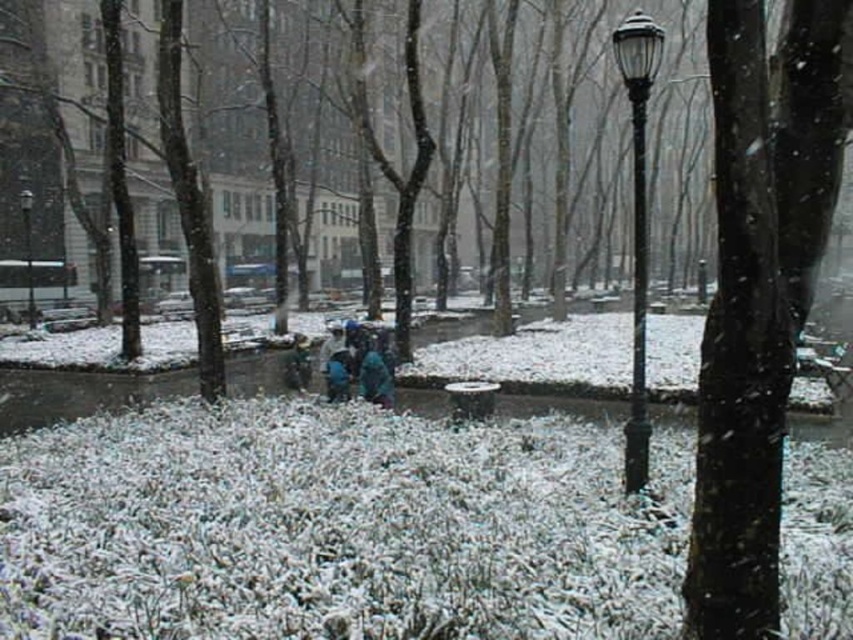
You are standing at the origin point in the winter scene. Which object corresponds to the coordinates point (x=637, y=224)?

The black polished metal lamp post at right corresponds to the coordinates point (x=637, y=224).